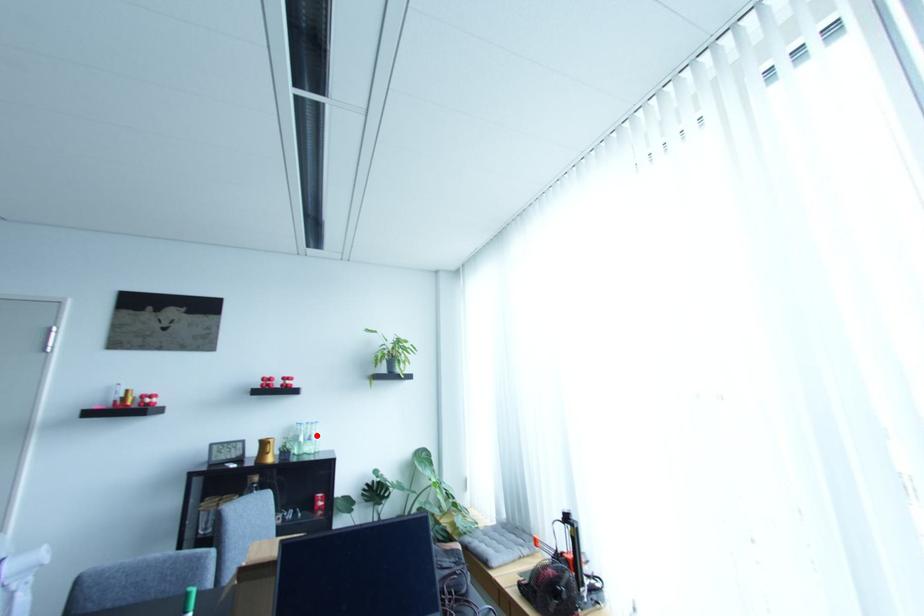
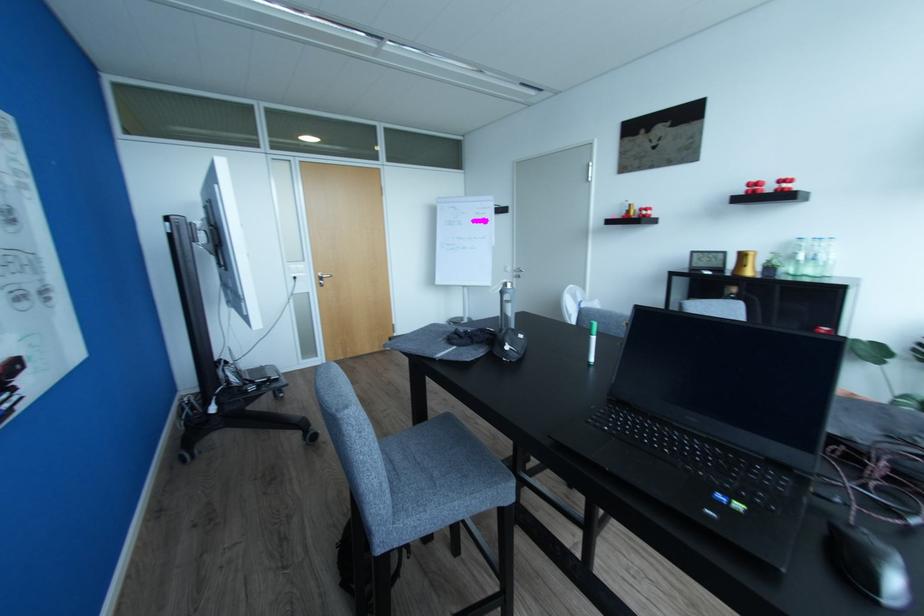
The point at the highlighted location is marked in the first image. Where is the corresponding point in the second image?

(824, 254)